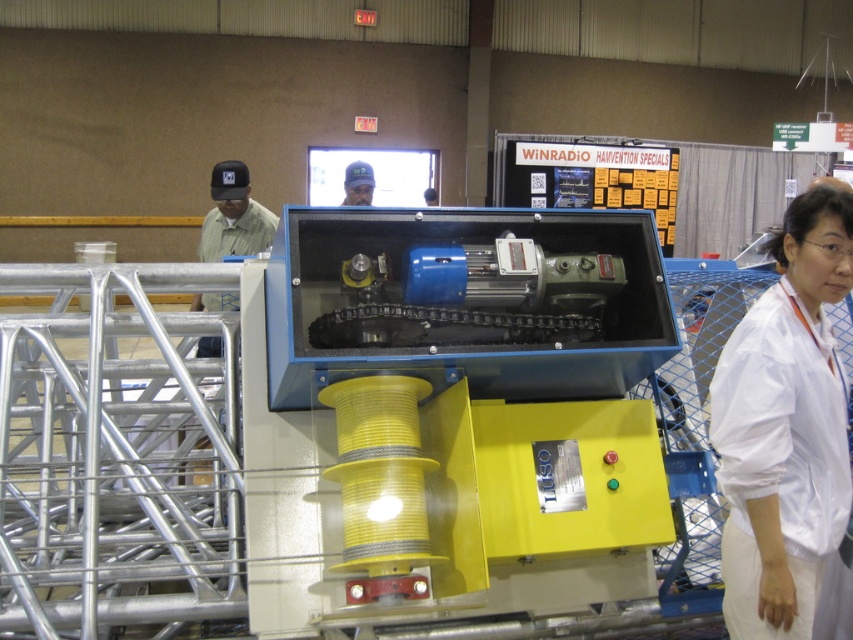
Can you confirm if white fabric at right is thinner than blue fabric cap at upper center?

In fact, white fabric at right might be wider than blue fabric cap at upper center.

How much distance is there between white fabric at right and blue fabric cap at upper center?

white fabric at right is 3.73 meters from blue fabric cap at upper center.

Is point (775, 348) positioned in front of point (370, 179)?

Yes, it is.

At what (x,y) coordinates should I click in order to perform the action: click on white fabric at right. Please return your answer as a coordinate pair (x, y). This screenshot has height=640, width=853. Looking at the image, I should click on (785, 426).

Can you confirm if matte green shirt at left is shorter than blue fabric cap at upper center?

No.

Can you confirm if matte green shirt at left is taller than blue fabric cap at upper center?

Indeed, matte green shirt at left has a greater height compared to blue fabric cap at upper center.

Locate an element on the screen. This screenshot has height=640, width=853. matte green shirt at left is located at coordinates (233, 216).

You are a GUI agent. You are given a task and a screenshot of the screen. Output one action in this format:
    pyautogui.click(x=<x>, y=<y>)
    Task: Click on the matte green shirt at left
    Image resolution: width=853 pixels, height=640 pixels.
    Given the screenshot: What is the action you would take?
    pyautogui.click(x=233, y=216)

Is white fabric at right closer to camera compared to matte green shirt at left?

Yes, white fabric at right is closer to the viewer.

Is white fabric at right bigger than matte green shirt at left?

No, white fabric at right is not bigger than matte green shirt at left.

The image size is (853, 640). What do you see at coordinates (785, 426) in the screenshot?
I see `white fabric at right` at bounding box center [785, 426].

Identify the location of white fabric at right. Image resolution: width=853 pixels, height=640 pixels. (785, 426).